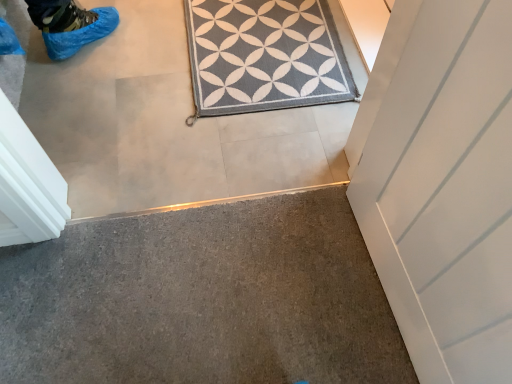
I want to click on gray textured rug at center, so click(x=264, y=56).

This screenshot has width=512, height=384. What do you see at coordinates (264, 56) in the screenshot?
I see `gray textured rug at center` at bounding box center [264, 56].

The width and height of the screenshot is (512, 384). What do you see at coordinates (202, 299) in the screenshot?
I see `gray carpet at lower left` at bounding box center [202, 299].

Locate an element on the screen. This screenshot has height=384, width=512. gray carpet at lower left is located at coordinates (202, 299).

Find the location of a particular element. The width and height of the screenshot is (512, 384). gray textured rug at center is located at coordinates (264, 56).

Visually, is gray textured rug at center positioned to the left or to the right of gray carpet at lower left?

Clearly, gray textured rug at center is on the right of gray carpet at lower left in the image.

Which object is closer to the camera, gray textured rug at center or gray carpet at lower left?

gray carpet at lower left is closer to the camera.

Is point (319, 72) farther from camera compared to point (185, 336)?

Yes.

From the image's perspective, would you say gray textured rug at center is positioned over gray carpet at lower left?

Yes, from the image's perspective, gray textured rug at center is on top of gray carpet at lower left.

From a real-world perspective, which is physically below, gray textured rug at center or gray carpet at lower left?

gray carpet at lower left, from a real-world perspective.

Considering the relative sizes of gray textured rug at center and gray carpet at lower left in the image provided, is gray textured rug at center thinner than gray carpet at lower left?

Indeed, gray textured rug at center has a lesser width compared to gray carpet at lower left.

Can you confirm if gray textured rug at center is shorter than gray carpet at lower left?

Correct, gray textured rug at center is not as tall as gray carpet at lower left.

Who is bigger, gray textured rug at center or gray carpet at lower left?

Bigger between the two is gray carpet at lower left.

Would you say gray textured rug at center is inside or outside gray carpet at lower left?

gray textured rug at center is outside gray carpet at lower left.

In the scene shown: Is gray textured rug at center with gray carpet at lower left?

gray textured rug at center is not next to gray carpet at lower left, and they're not touching.

Is gray textured rug at center oriented away from gray carpet at lower left?

gray textured rug at center is not turned away from gray carpet at lower left.

How far apart are gray textured rug at center and gray carpet at lower left?

A: 25.86 inches.

This screenshot has width=512, height=384. In order to click on doormat above the gray carpet at lower left (from a real-world perspective) in this screenshot , I will do (x=264, y=56).

Is gray carpet at lower left at the left side of gray textured rug at center?

Correct, you'll find gray carpet at lower left to the left of gray textured rug at center.

Is gray carpet at lower left behind gray textured rug at center?

No, it is in front of gray textured rug at center.

Which is nearer, (308, 192) or (195, 83)?

Point (308, 192) is closer to the camera than point (195, 83).

Looking at this image, from the image's perspective, does gray carpet at lower left appear lower than gray textured rug at center?

Indeed, from the image's perspective, gray carpet at lower left is shown beneath gray textured rug at center.

From a real-world perspective, does gray carpet at lower left stand above gray textured rug at center?

Actually, gray carpet at lower left is physically below gray textured rug at center in the real world.

Can you confirm if gray carpet at lower left is wider than gray textured rug at center?

Yes.

Considering the sizes of objects gray carpet at lower left and gray textured rug at center in the image provided, who is shorter, gray carpet at lower left or gray textured rug at center?

Standing shorter between the two is gray textured rug at center.

Is gray carpet at lower left bigger or smaller than gray textured rug at center?

Considering their sizes, gray carpet at lower left takes up more space than gray textured rug at center.

Is gray textured rug at center located within gray carpet at lower left?

No, gray textured rug at center is not surrounded by gray carpet at lower left.

Is gray carpet at lower left not close to gray textured rug at center?

gray carpet at lower left is near gray textured rug at center, not far away.

Is gray carpet at lower left oriented towards gray textured rug at center?

Yes, gray carpet at lower left is aimed at gray textured rug at center.

Measure the distance between gray carpet at lower left and gray textured rug at center.

The distance of gray carpet at lower left from gray textured rug at center is 25.86 inches.

The height and width of the screenshot is (384, 512). What are the coordinates of `concrete on the left of gray textured rug at center` in the screenshot? It's located at (202, 299).

I want to click on concrete below the gray textured rug at center (from a real-world perspective), so click(202, 299).

This screenshot has height=384, width=512. I want to click on concrete in front of the gray textured rug at center, so click(x=202, y=299).